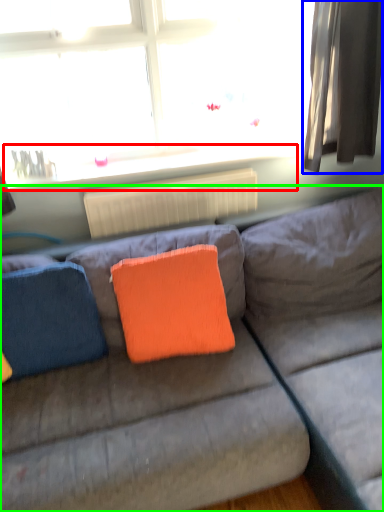
Question: Estimate the real-world distances between objects in this image. Which object is farther from window sill (highlighted by a red box), curtain (highlighted by a blue box) or studio couch (highlighted by a green box)?

Choices:
 (A) curtain
 (B) studio couch

Answer: (B)